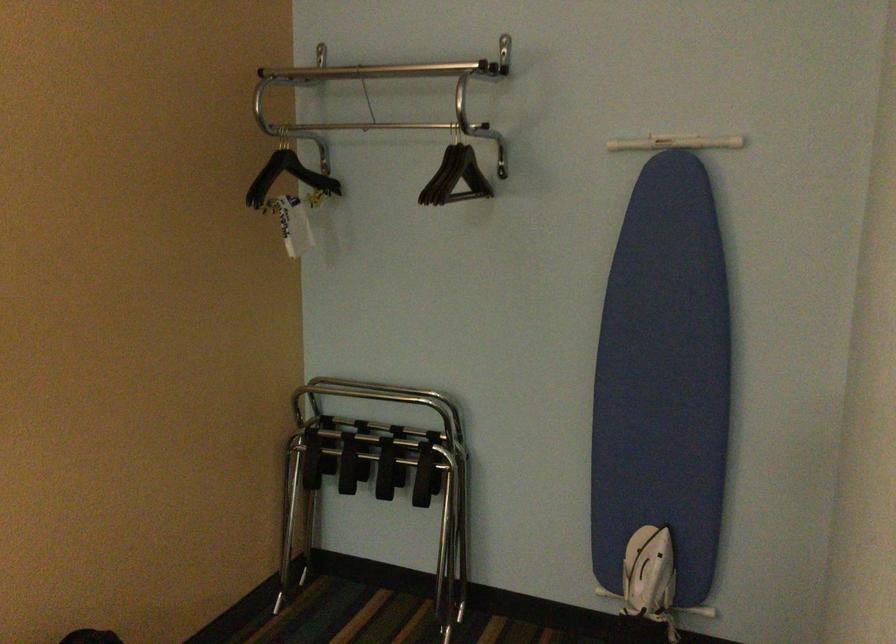
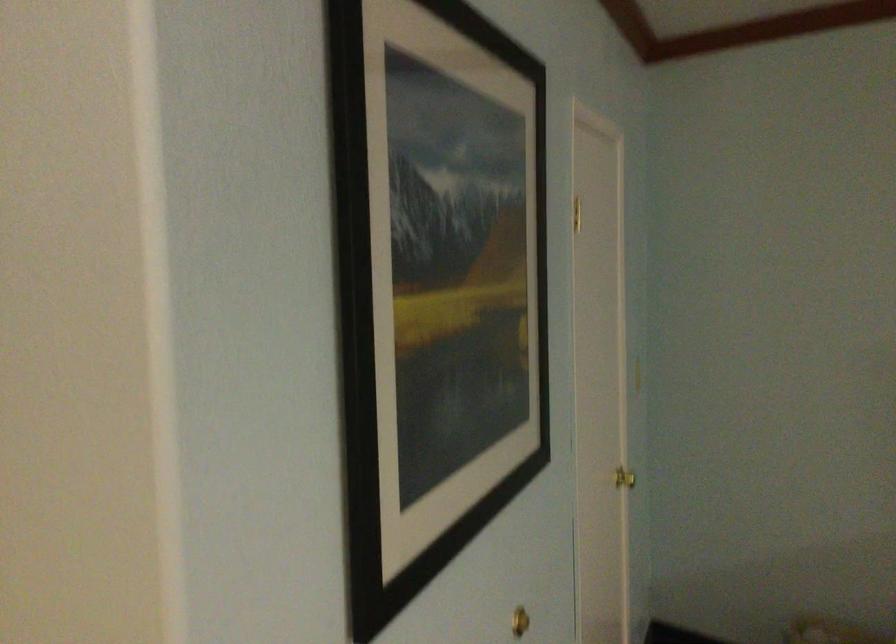
Question: Based on the continuous images, in which direction is the camera rotating? Reply with the corresponding letter.

Choices:
 (A) Left
 (B) Right
 (C) Up
 (D) Down

Answer: (B)